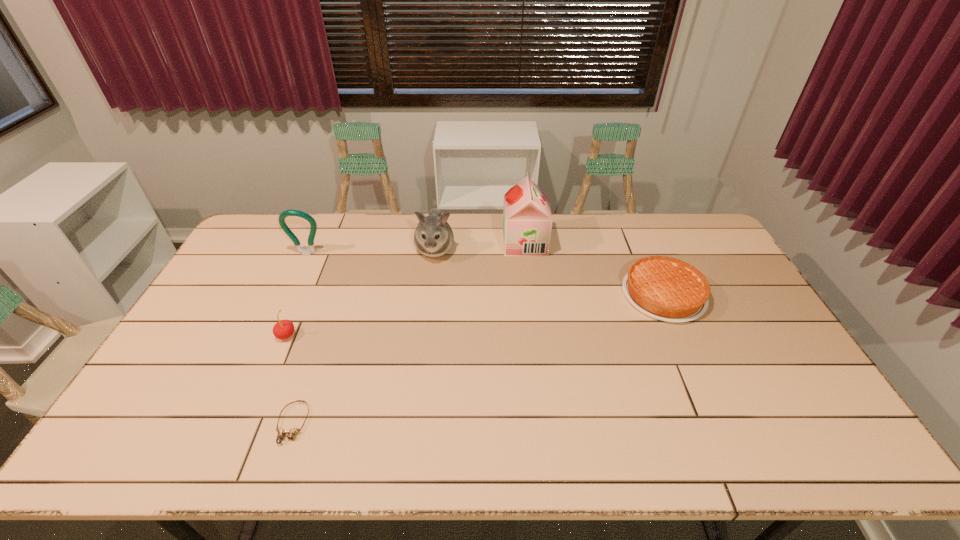
The image size is (960, 540). In order to click on soya milk in this screenshot , I will do `click(527, 220)`.

Where is `the fifth object from left to right`? This screenshot has height=540, width=960. the fifth object from left to right is located at coordinates (527, 220).

The image size is (960, 540). What are the coordinates of `bottle opener` in the screenshot? It's located at (311, 250).

What are the coordinates of `hamster` in the screenshot? It's located at (433, 237).

Find the location of `cherry`. cherry is located at coordinates (283, 329).

You are a GUI agent. You are given a task and a screenshot of the screen. Output one action in this format:
    pyautogui.click(x=<x>, y=<y>)
    Task: Click on the fourth tallest object
    The image size is (960, 540).
    Given the screenshot: What is the action you would take?
    pyautogui.click(x=283, y=329)

This screenshot has width=960, height=540. Identify the location of the fifth tallest object. (664, 288).

Image resolution: width=960 pixels, height=540 pixels. I want to click on the third nearest object, so click(x=664, y=288).

Locate an element on the screen. the nearest object is located at coordinates (292, 433).

Identify the location of the fourth object from right to left. (292, 433).